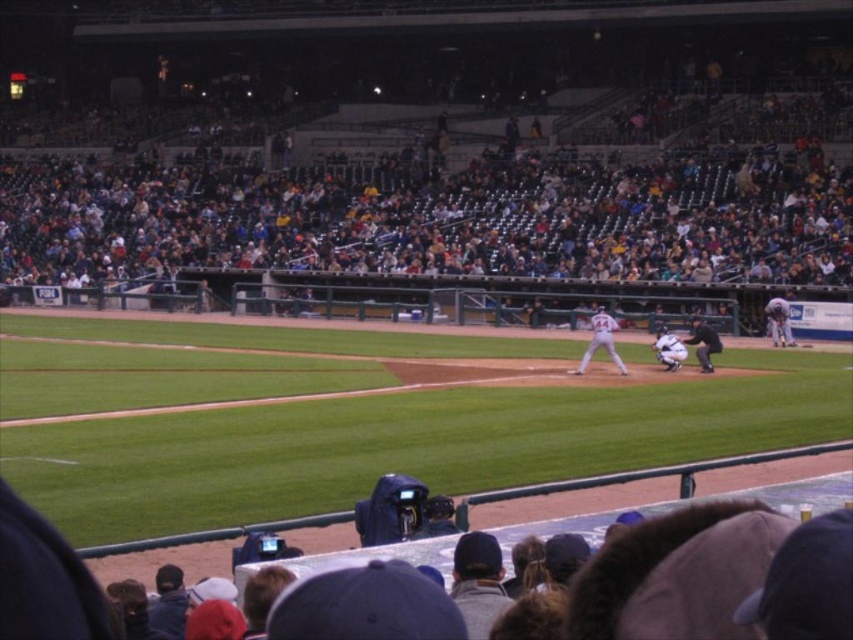
Question: Estimate the real-world distances between objects in this image. Which object is closer to the white uniform at center?

Choices:
 (A) black uniform umpire at center
 (B) white uniform player at center
 (C) white matte uniform at center

Answer: (A)

Question: Can you confirm if white uniform player at center is positioned below white matte uniform at center?

Choices:
 (A) no
 (B) yes

Answer: (A)

Question: Which object is closer to the camera taking this photo?

Choices:
 (A) white matte uniform at center
 (B) white uniform at center
 (C) black uniform umpire at center

Answer: (C)

Question: Which of the following is the closest to the observer?

Choices:
 (A) (780, 316)
 (B) (583, 358)
 (C) (672, 344)
 (D) (705, 332)

Answer: (B)

Question: From the image, what is the correct spatial relationship of white uniform player at center in relation to black uniform umpire at center?

Choices:
 (A) left
 (B) right

Answer: (A)

Question: Can you confirm if white uniform player at center is positioned to the left of black uniform umpire at center?

Choices:
 (A) yes
 (B) no

Answer: (A)